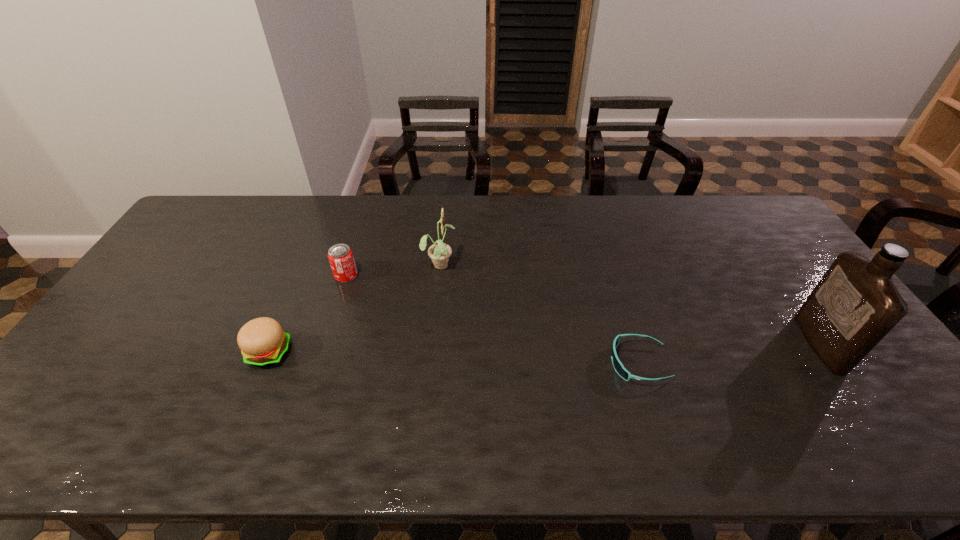
You are a GUI agent. You are given a task and a screenshot of the screen. Output one action in this format:
    pyautogui.click(x=<x>, y=<y>)
    Task: Click on the free location at the left edge
    
    Given the screenshot: What is the action you would take?
    pyautogui.click(x=109, y=339)

Identify the location of vacant area at the right edge. Image resolution: width=960 pixels, height=540 pixels. (802, 335).

You are a GUI agent. You are given a task and a screenshot of the screen. Output one action in this format:
    pyautogui.click(x=<x>, y=<y>)
    Task: Click on the vacant region at the far right corner
    The height and width of the screenshot is (540, 960).
    Given the screenshot: What is the action you would take?
    pyautogui.click(x=733, y=213)

The image size is (960, 540). What are the coordinates of `vacant area that lies between the sunglasses and the leftmost object` in the screenshot? It's located at (453, 358).

This screenshot has height=540, width=960. Identify the location of free space between the leftmost object and the can. (307, 314).

The image size is (960, 540). Find the location of `vacant space that is in between the hamburger and the second tallest object`. vacant space that is in between the hamburger and the second tallest object is located at coordinates (354, 308).

Identify the location of vacant area that lies between the sunglasses and the fourth object from right to left. tap(492, 320).

I want to click on vacant point located between the second tallest object and the can, so click(x=393, y=270).

Where is `vacant space in between the can and the sunglasses`? vacant space in between the can and the sunglasses is located at coordinates (492, 320).

What are the coordinates of `free space between the sunglasses and the leftmost object` in the screenshot? It's located at (453, 358).